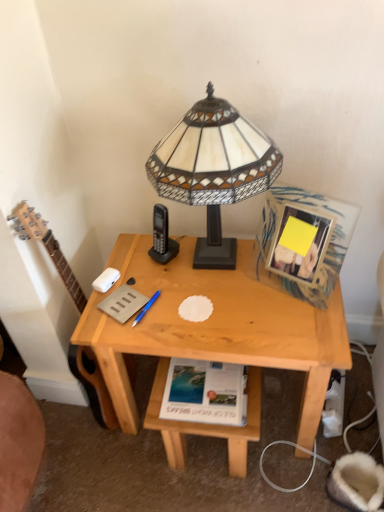
Image resolution: width=384 pixels, height=512 pixels. I want to click on free spot in front of wooden picture frame at upper right, so click(x=301, y=322).